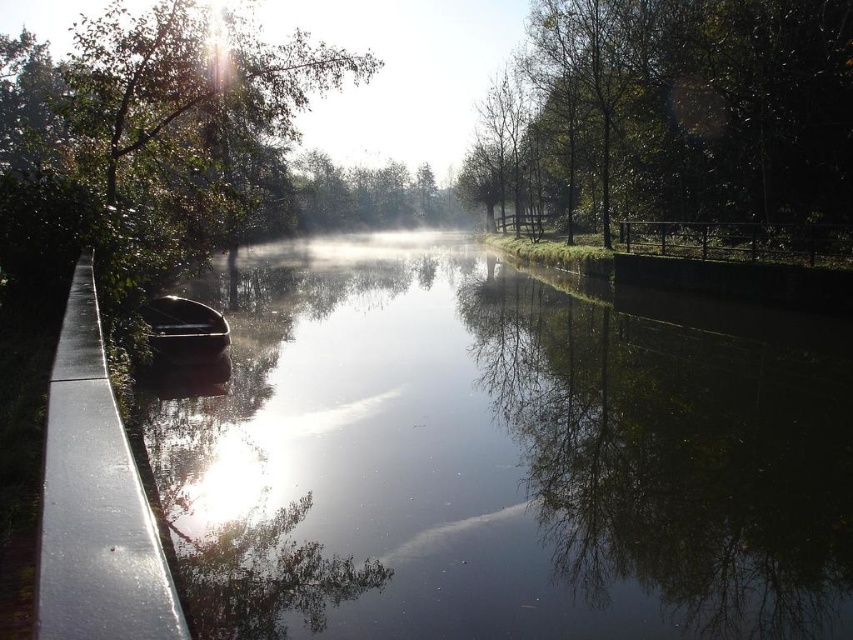
You are standing on the left bank of the waterway and see the point marked at coordinates (492, 460). What is the nature of the surface at that point?

The point at coordinates (492, 460) corresponds to the black glossy water at left, which is a reflective surface.

You are standing on the left bank of the waterway and want to take a photo of both point (x=352, y=380) and point (x=177, y=321). Which point will appear larger in your photo?

Point (x=352, y=380) is closer to the camera than point (x=177, y=321), so it will appear larger in the photo.

You are an artist planning to paint the scene. You want to ensure the green leafy tree at upper right and the shiny black canoe at center are proportionally accurate. Which object should you draw wider in your painting?

The green leafy tree at upper right should be drawn wider in the painting since its width is larger than that of the shiny black canoe at center according to the description.